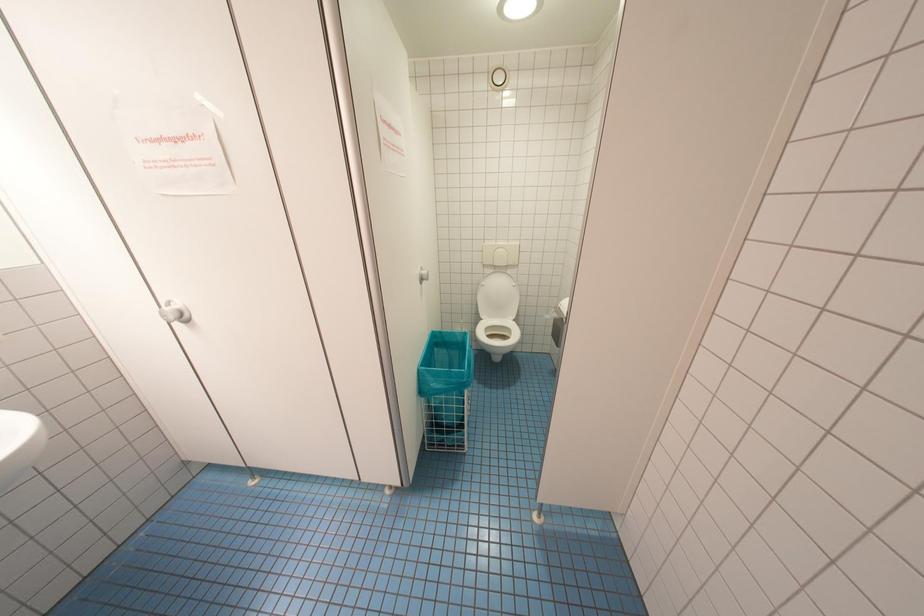
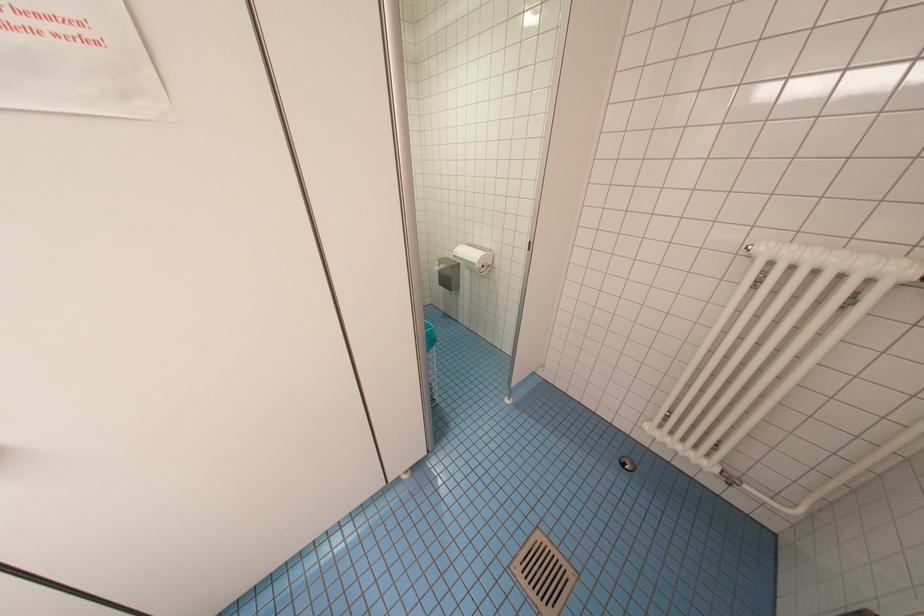
Question: The first image is from the beginning of the video and the second image is from the end. How did the camera likely rotate when shooting the video?

Choices:
 (A) Left
 (B) Right
 (C) Up
 (D) Down

Answer: (B)